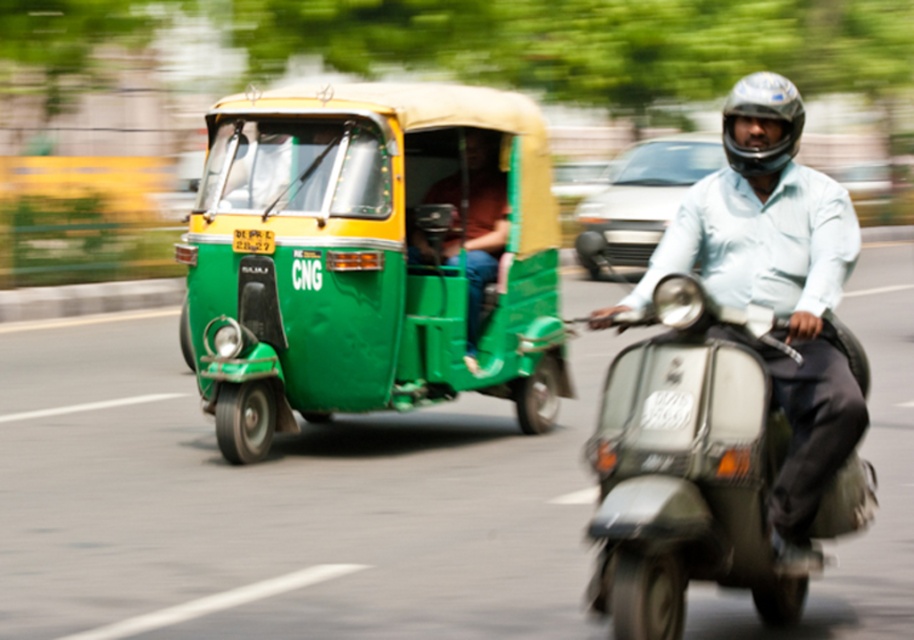
Who is positioned more to the left, metallic silver scooter at center or shiny black helmet at upper right?

metallic silver scooter at center

Is the position of metallic silver scooter at center less distant than that of shiny black helmet at upper right?

Yes.

Find the location of a particular element. metallic silver scooter at center is located at coordinates (686, 468).